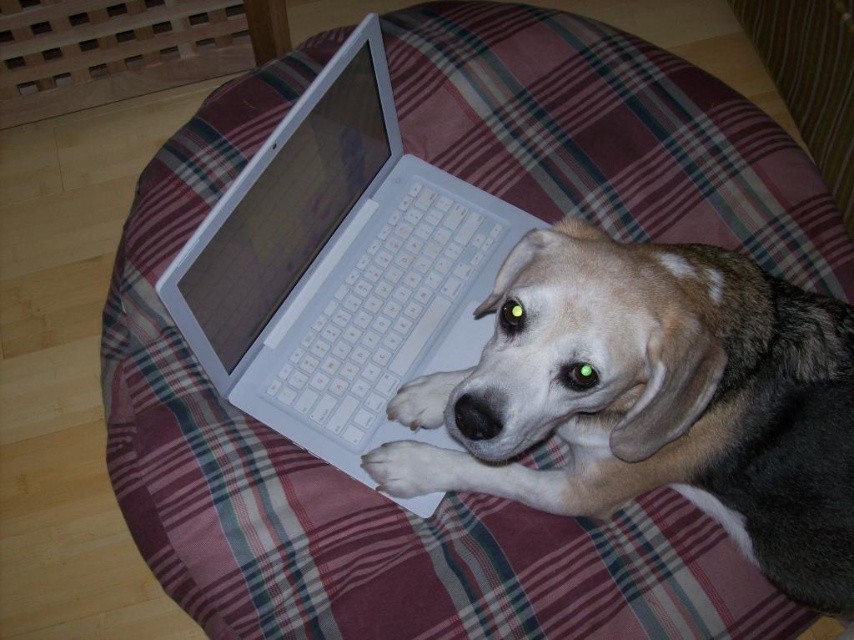
Which of these two, light brown fur at center or white soft paw at lower center, stands taller?

light brown fur at center

Based on the photo, which is above, light brown fur at center or white soft paw at lower center?

white soft paw at lower center is above.

The height and width of the screenshot is (640, 854). What do you see at coordinates (670, 396) in the screenshot?
I see `light brown fur at center` at bounding box center [670, 396].

Where is `light brown fur at center`? light brown fur at center is located at coordinates (670, 396).

This screenshot has width=854, height=640. What are the coordinates of `white soft fur paw at center` in the screenshot? It's located at (410, 468).

Who is positioned more to the right, white soft fur paw at center or white soft paw at lower center?

white soft paw at lower center is more to the right.

Locate an element on the screen. Image resolution: width=854 pixels, height=640 pixels. white soft fur paw at center is located at coordinates (410, 468).

Which of these two, white plastic keyboard at center or white soft fur paw at center, stands taller?

white plastic keyboard at center is taller.

What do you see at coordinates (382, 310) in the screenshot? I see `white plastic keyboard at center` at bounding box center [382, 310].

What are the coordinates of `white plastic keyboard at center` in the screenshot? It's located at (382, 310).